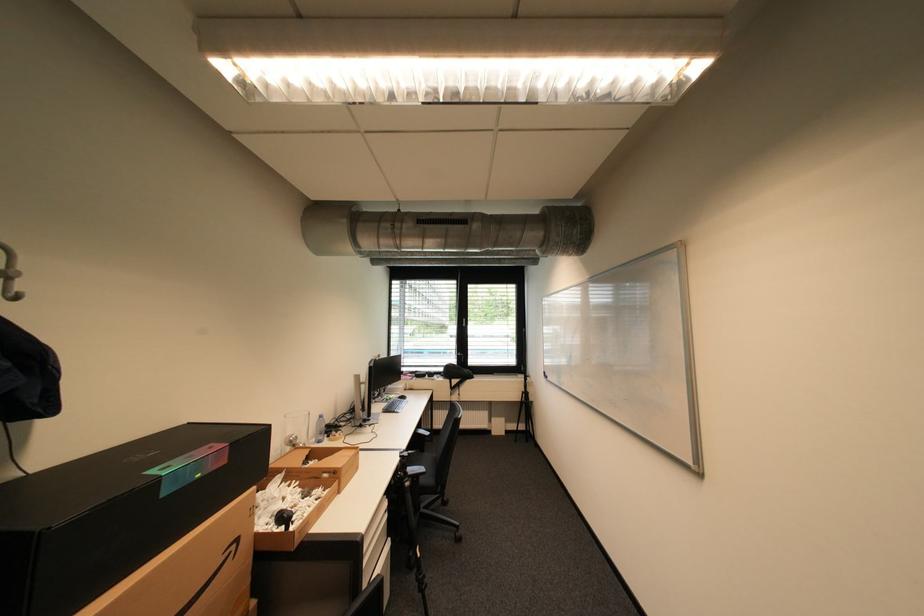
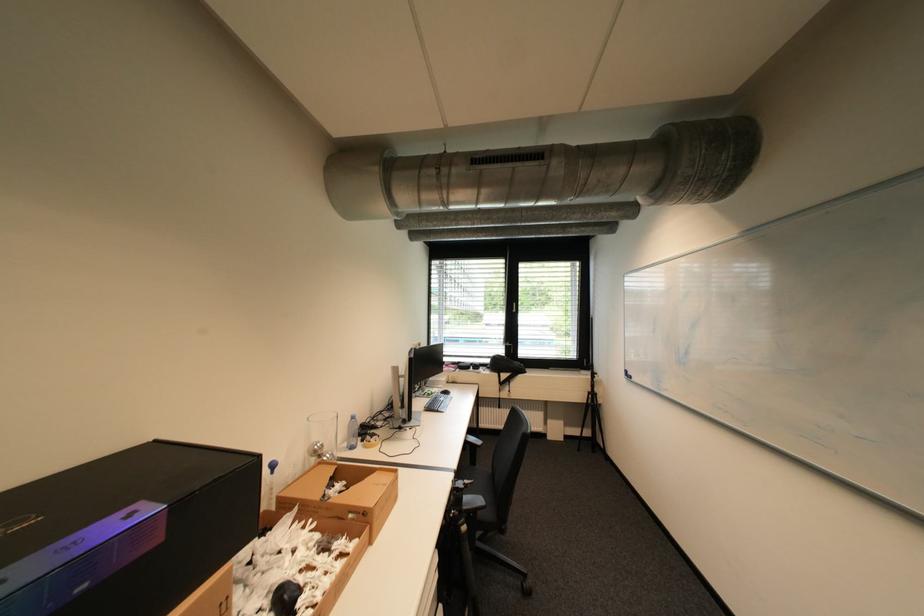
Looking at this image, what movement of the cameraman would produce the second image?

The cameraman moved toward left, forward.